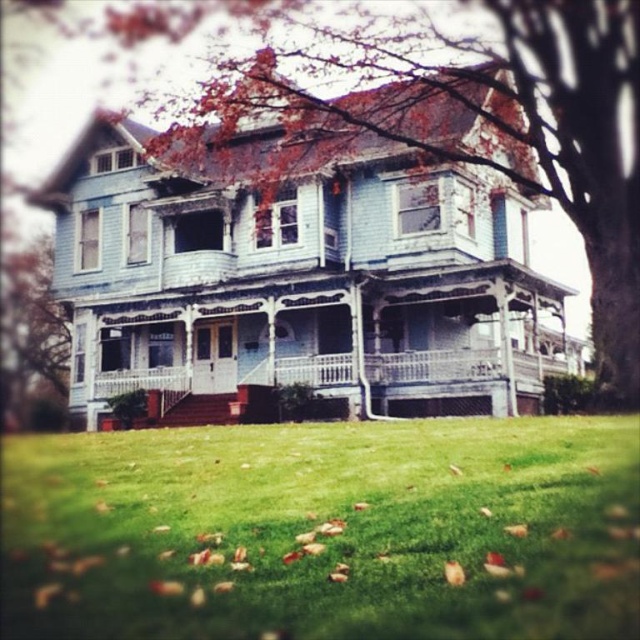
Does green grass at lower center appear under green leafy tree at left?

Indeed, green grass at lower center is positioned under green leafy tree at left.

Does green grass at lower center have a greater width compared to green leafy tree at left?

Correct, the width of green grass at lower center exceeds that of green leafy tree at left.

Who is more distant from viewer, (x=596, y=426) or (x=58, y=324)?

The point (x=58, y=324) is behind.

This screenshot has width=640, height=640. In order to click on green grass at lower center in this screenshot , I will do `click(323, 534)`.

You are a GUI agent. You are given a task and a screenshot of the screen. Output one action in this format:
    pyautogui.click(x=<x>, y=<y>)
    Task: Click on the smooth bark tree at upper center
    The image size is (640, 640).
    Given the screenshot: What is the action you would take?
    pyautogui.click(x=349, y=192)

Is smooth bark tree at upper center further to camera compared to green leafy tree at left?

No, smooth bark tree at upper center is in front of green leafy tree at left.

Which is in front, point (406, 65) or point (45, 381)?

Point (406, 65) is more forward.

Find the location of a particular element. The width and height of the screenshot is (640, 640). smooth bark tree at upper center is located at coordinates (349, 192).

Is point (472, 84) less distant than point (141, 509)?

That is False.

Which is in front, point (531, 173) or point (77, 548)?

Positioned in front is point (77, 548).

Locate an element on the screen. The image size is (640, 640). smooth bark tree at upper center is located at coordinates (349, 192).